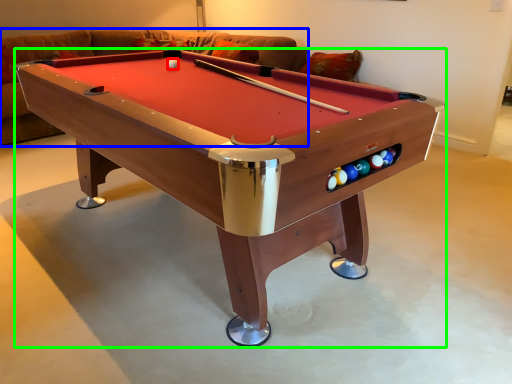
Question: Estimate the real-world distances between objects in this image. Which object is farther from ball (highlighted by a red box), couch (highlighted by a blue box) or billiard table (highlighted by a green box)?

Choices:
 (A) couch
 (B) billiard table

Answer: (A)